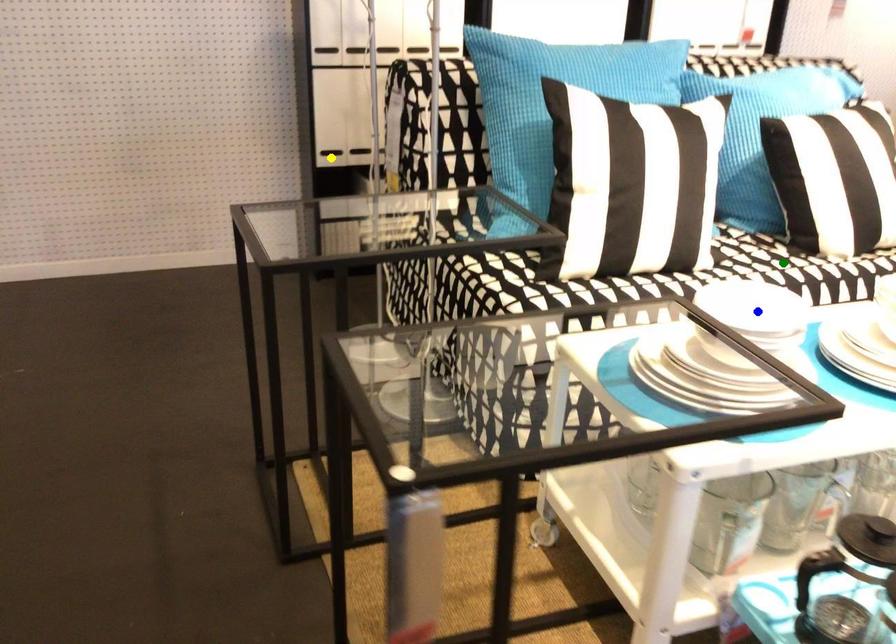
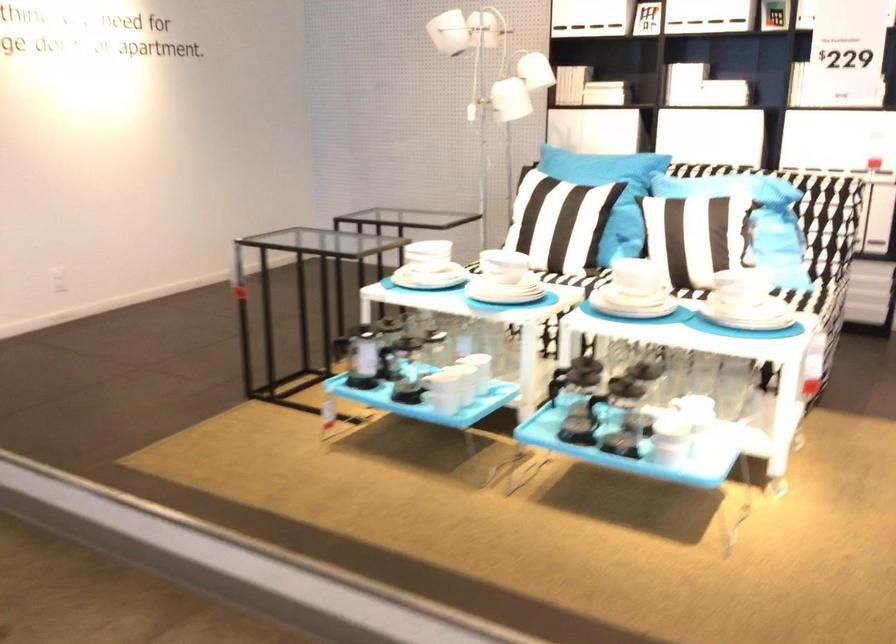
I am providing you with two images of the same scene from different viewpoints. Three points are marked in image1. Which point corresponds to a part or object that is occluded in image2?In image1, three points are marked. Which of them correspond to a part or object that is occluded in image2?Among the three points shown in image1, which one corresponds to a part or object that is no longer visible due to occlusion in image2?

yellow point, green point, blue point cannot be seen in image2.